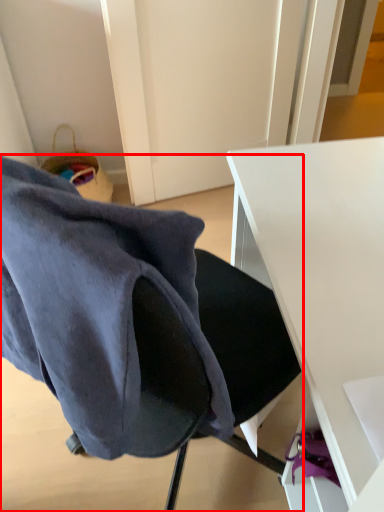
Question: From the image's perspective, what is the correct spatial positioning of chair (annotated by the red box) in reference to desk?

Choices:
 (A) below
 (B) above

Answer: (B)